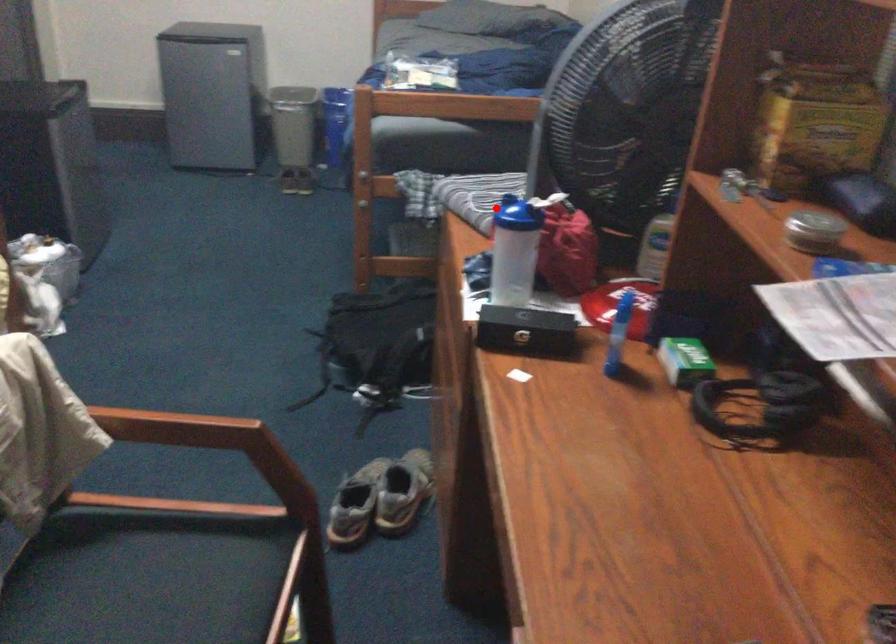
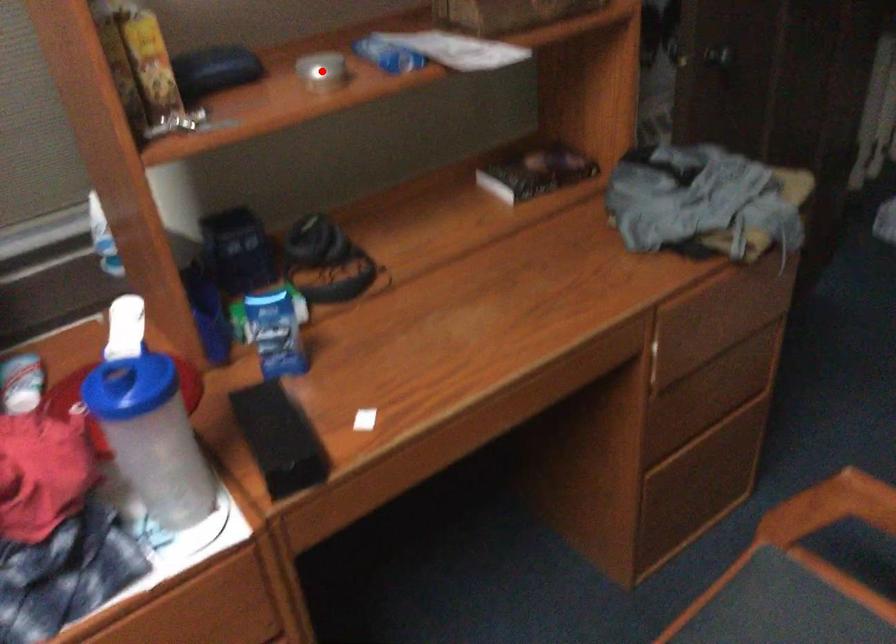
Based on the photo, I am providing you with two images of the same scene from different viewpoints. A red point is marked on the first image and another point is marked on the second image. Is the red point in image1 aligned with the point shown in image2?

No